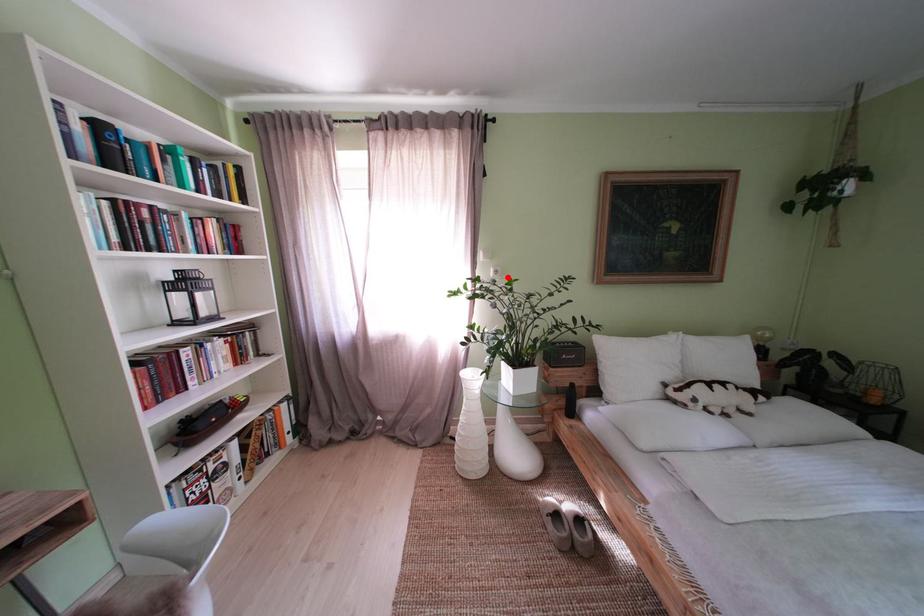
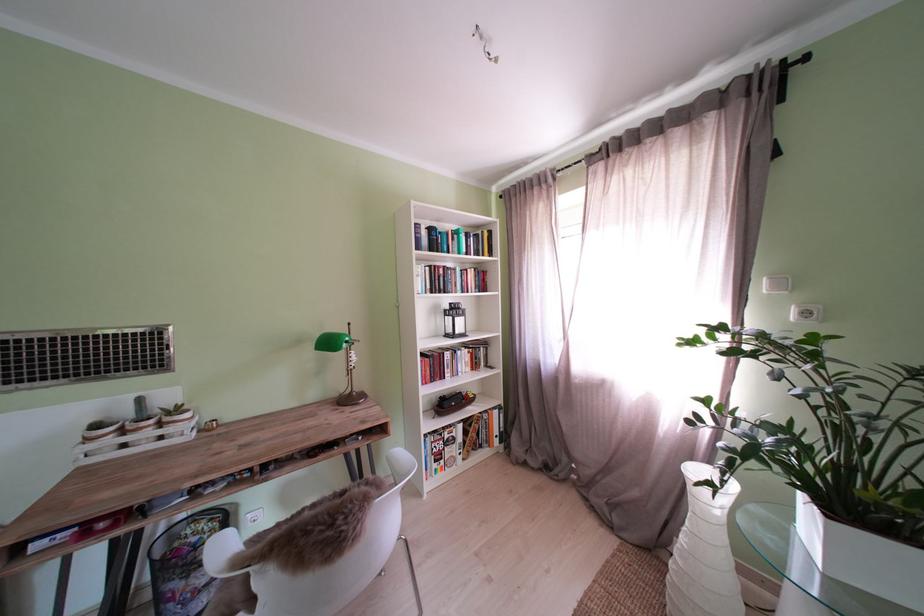
Find the pixel in the second image that matches the highlighted location in the first image.

(818, 318)